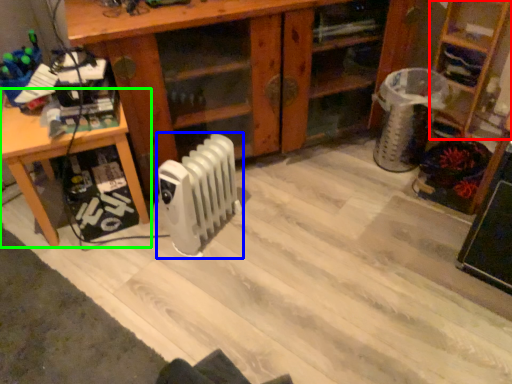
Question: Considering the real-world distances, which object is farthest from shelf (highlighted by a red box)? radiator (highlighted by a blue box) or table (highlighted by a green box)?

Choices:
 (A) radiator
 (B) table

Answer: (B)